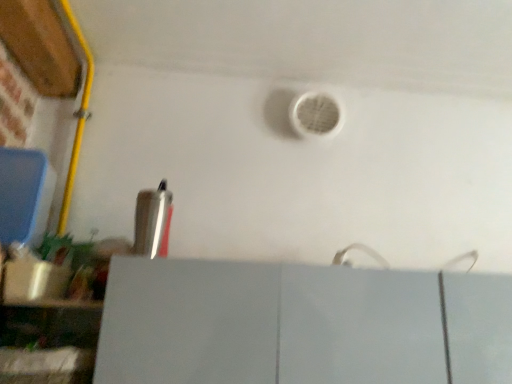
This screenshot has height=384, width=512. Describe the element at coordinates (300, 325) in the screenshot. I see `white matte cabinet at lower center` at that location.

Where is `white matte cabinet at lower center`? white matte cabinet at lower center is located at coordinates (300, 325).

Where is `white matte cabinet at lower center`? The height and width of the screenshot is (384, 512). white matte cabinet at lower center is located at coordinates (300, 325).